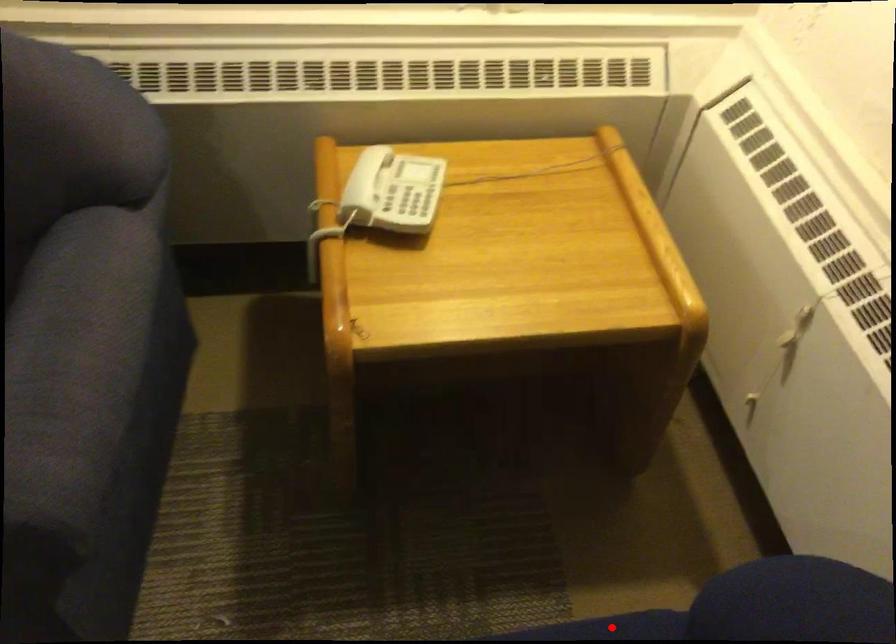
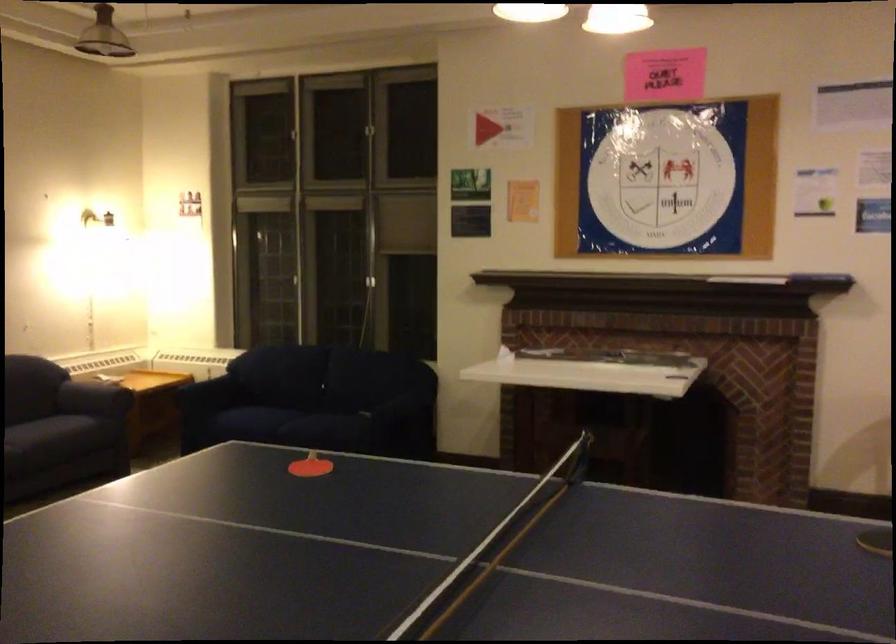
Question: I am providing you with two images of the same scene from different viewpoints. A red point is marked on the first image. Is the red point's position out of view in image 2?

Choices:
 (A) Yes
 (B) No

Answer: (A)